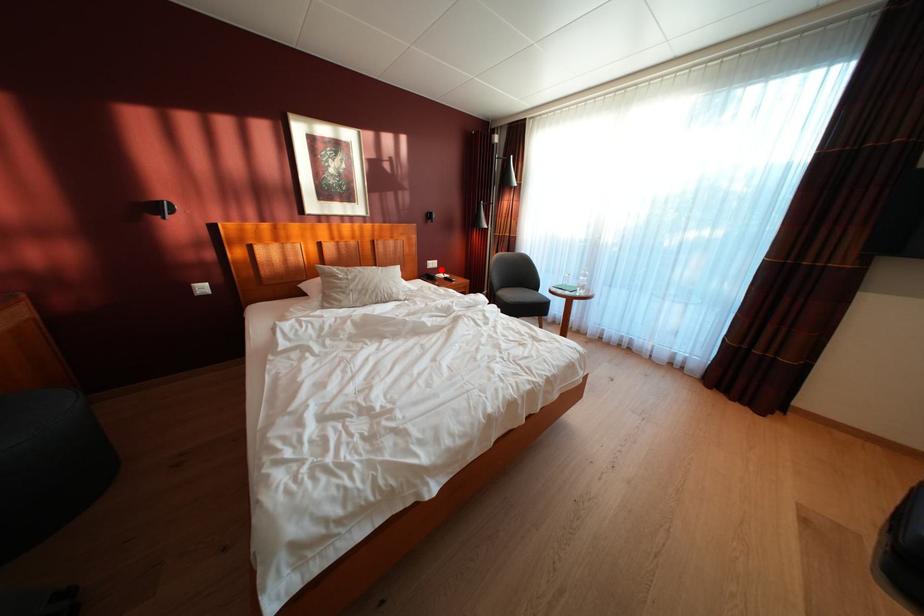
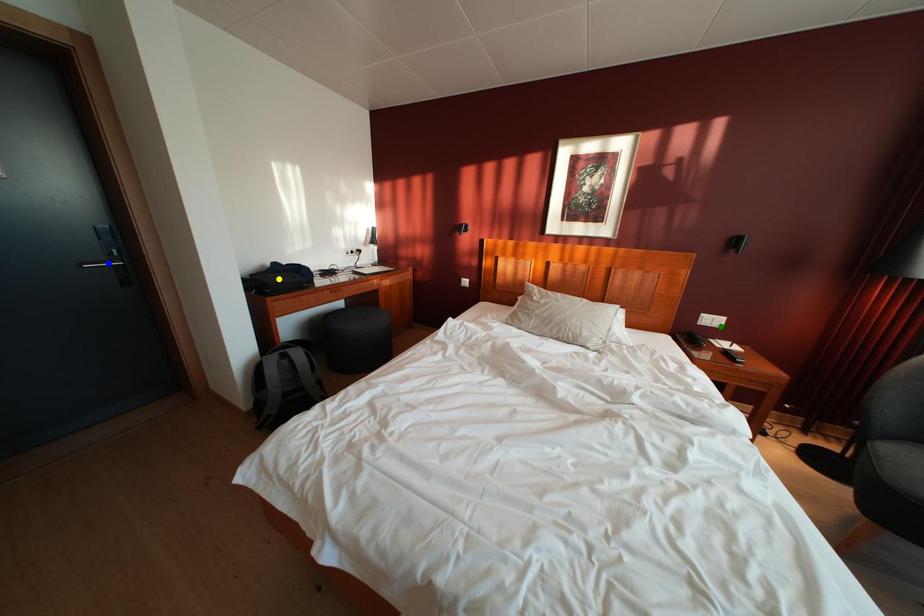
Question: I am providing you with two images of the same scene from different viewpoints. A red point is marked on the first image. You are given multiple points on the second image. Which spot in image 2 lines up with the point in image 1?

Choices:
 (A) blue point
 (B) yellow point
 (C) green point

Answer: (C)